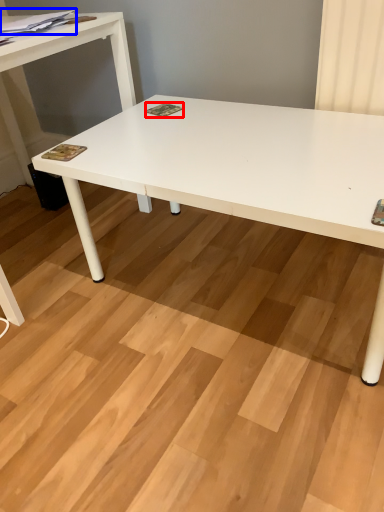
Question: Which object is further to the camera taking this photo, magazine (highlighted by a red box) or magazine (highlighted by a blue box)?

Choices:
 (A) magazine
 (B) magazine

Answer: (A)